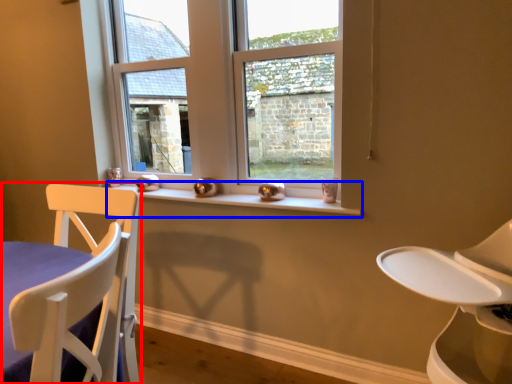
Question: Which point is closer to the camera, chair (highlighted by a red box) or window sill (highlighted by a blue box)?

Choices:
 (A) chair
 (B) window sill

Answer: (A)